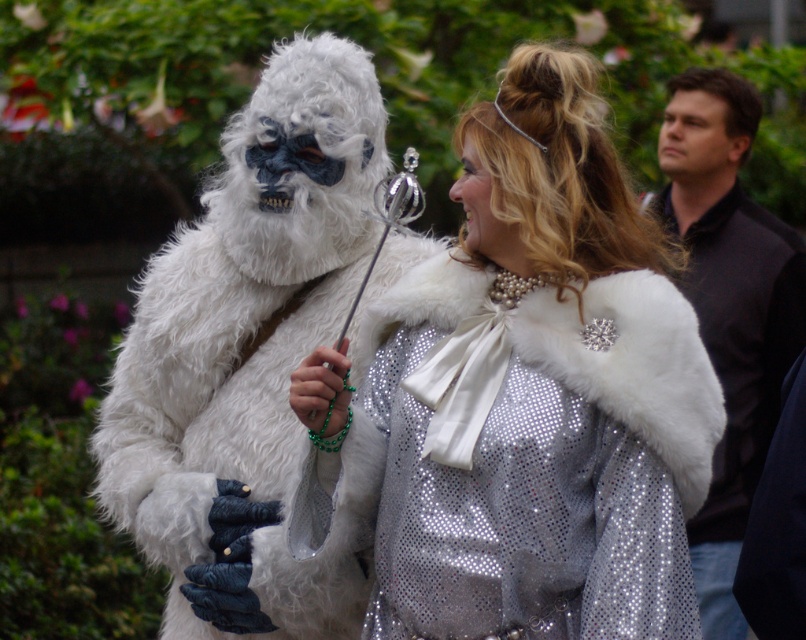
Is point (356, 417) closer to viewer compared to point (291, 234)?

Yes.

Can you confirm if shiny silver cape at center is bigger than white furry coat at center?

No.

What do you see at coordinates (522, 397) in the screenshot? Image resolution: width=806 pixels, height=640 pixels. I see `shiny silver cape at center` at bounding box center [522, 397].

Image resolution: width=806 pixels, height=640 pixels. What are the coordinates of `shiny silver cape at center` in the screenshot? It's located at tap(522, 397).

Between white furry coat at center and dark brown shirt at right, which one has less height?

white furry coat at center

From the picture: Does white furry coat at center appear under dark brown shirt at right?

Yes, white furry coat at center is below dark brown shirt at right.

The height and width of the screenshot is (640, 806). What are the coordinates of `white furry coat at center` in the screenshot? It's located at (247, 349).

Is shiny silver cape at center shorter than dark brown shirt at right?

Yes, shiny silver cape at center is shorter than dark brown shirt at right.

Is shiny silver cape at center below dark brown shirt at right?

Indeed, shiny silver cape at center is positioned under dark brown shirt at right.

The height and width of the screenshot is (640, 806). What are the coordinates of `shiny silver cape at center` in the screenshot? It's located at (522, 397).